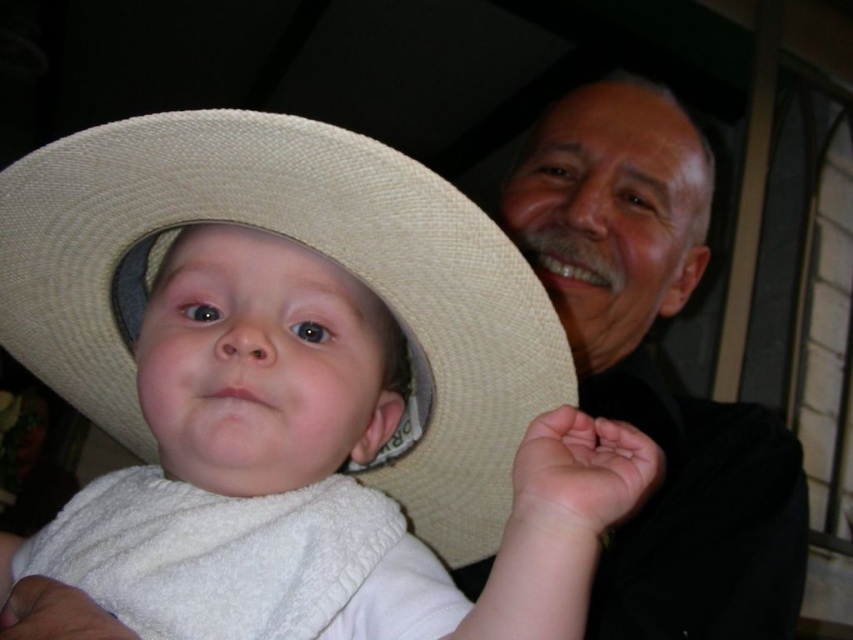
In the scene shown: Does beige straw cowboy hat at center appear on the left side of smooth black shirt at upper right?

Yes, beige straw cowboy hat at center is to the left of smooth black shirt at upper right.

Is point (534, 397) positioned behind point (735, 618)?

That is False.

Identify the location of beige straw cowboy hat at center. (314, 250).